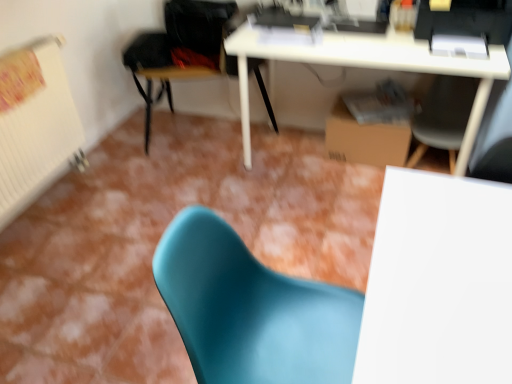
Question: Is matte teal chair at lower center, the first chair positioned from the front, further to camera compared to brown cardboard box at lower right?

Choices:
 (A) no
 (B) yes

Answer: (A)

Question: From the image's perspective, is matte teal chair at lower center, which is the 2th chair from right to left, located beneath brown cardboard box at lower right?

Choices:
 (A) no
 (B) yes

Answer: (B)

Question: Does matte teal chair at lower center, the first chair positioned from the front, have a lesser height compared to brown cardboard box at lower right?

Choices:
 (A) yes
 (B) no

Answer: (B)

Question: Is matte teal chair at lower center, the first chair positioned from the front, thinner than brown cardboard box at lower right?

Choices:
 (A) no
 (B) yes

Answer: (A)

Question: Would you consider matte teal chair at lower center, the 3th chair when ordered from back to front, to be distant from brown cardboard box at lower right?

Choices:
 (A) yes
 (B) no

Answer: (A)

Question: Considering the positions of brown cardboard box at lower right and white matte table at center in the image, is brown cardboard box at lower right taller or shorter than white matte table at center?

Choices:
 (A) short
 (B) tall

Answer: (A)

Question: Looking at the image, does brown cardboard box at lower right seem bigger or smaller compared to white matte table at center?

Choices:
 (A) small
 (B) big

Answer: (A)

Question: Is brown cardboard box at lower right to the left or to the right of white matte table at center in the image?

Choices:
 (A) left
 (B) right

Answer: (B)

Question: From a real-world perspective, is brown cardboard box at lower right positioned above or below white matte table at center?

Choices:
 (A) below
 (B) above

Answer: (A)

Question: Looking at their shapes, would you say brown cardboard box at lower right is wider or thinner than matte gray chair at center, which is the 2th chair in back-to-front order?

Choices:
 (A) thin
 (B) wide

Answer: (A)

Question: In the image, is brown cardboard box at lower right positioned in front of or behind matte gray chair at center, which is the second chair in front-to-back order?

Choices:
 (A) behind
 (B) front

Answer: (A)

Question: Considering the relative positions of brown cardboard box at lower right and matte gray chair at center, positioned as the first chair in right-to-left order, in the image provided, is brown cardboard box at lower right to the left or to the right of matte gray chair at center, positioned as the first chair in right-to-left order,?

Choices:
 (A) left
 (B) right

Answer: (A)

Question: Is brown cardboard box at lower right situated inside matte gray chair at center, marked as the 3th chair in a left-to-right arrangement, or outside?

Choices:
 (A) inside
 (B) outside

Answer: (B)

Question: Considering the positions of matte gray chair at center, positioned as the first chair in right-to-left order, and matte teal chair at lower center, which is the 2th chair from right to left, in the image, is matte gray chair at center, positioned as the first chair in right-to-left order, bigger or smaller than matte teal chair at lower center, which is the 2th chair from right to left,?

Choices:
 (A) small
 (B) big

Answer: (A)

Question: Considering the positions of matte gray chair at center, positioned as the first chair in right-to-left order, and matte teal chair at lower center, the first chair positioned from the front, in the image, is matte gray chair at center, positioned as the first chair in right-to-left order, wider or thinner than matte teal chair at lower center, the first chair positioned from the front,?

Choices:
 (A) thin
 (B) wide

Answer: (A)